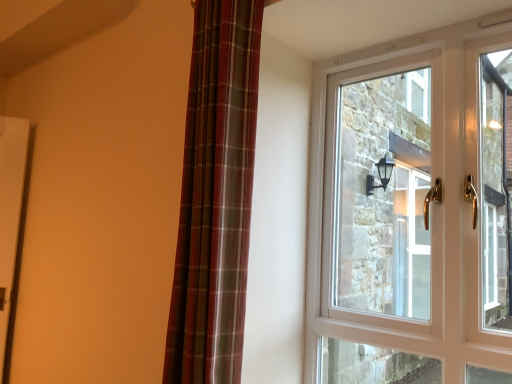
What do you see at coordinates (411, 211) in the screenshot? I see `white glossy door at upper right` at bounding box center [411, 211].

You are a GUI agent. You are given a task and a screenshot of the screen. Output one action in this format:
    pyautogui.click(x=<x>, y=<y>)
    Task: Click on the white glossy door at upper right
    The height and width of the screenshot is (384, 512).
    Given the screenshot: What is the action you would take?
    pyautogui.click(x=411, y=211)

Measure the distance between point (191, 272) and camera.

Point (191, 272) is 1.24 meters away from camera.

At what (x,y) coordinates should I click in order to perform the action: click on plaid fabric curtain at left. Please return your answer as a coordinate pair (x, y). Looking at the image, I should click on (215, 196).

What do you see at coordinates (215, 196) in the screenshot? I see `plaid fabric curtain at left` at bounding box center [215, 196].

The height and width of the screenshot is (384, 512). I want to click on white glossy door at upper right, so pos(411,211).

Does white glossy door at upper right appear on the right side of plaid fabric curtain at left?

Correct, you'll find white glossy door at upper right to the right of plaid fabric curtain at left.

Is white glossy door at upper right behind plaid fabric curtain at left?

That is True.

Considering the positions of point (449, 190) and point (214, 141), is point (449, 190) closer or farther from the camera than point (214, 141)?

Point (449, 190) appears to be farther away from the viewer than point (214, 141).

From the image's perspective, is white glossy door at upper right above or below plaid fabric curtain at left?

white glossy door at upper right is below plaid fabric curtain at left.

From a real-world perspective, does white glossy door at upper right sit lower than plaid fabric curtain at left?

Yes.

Which of these two, white glossy door at upper right or plaid fabric curtain at left, is thinner?

With smaller width is white glossy door at upper right.

Can you confirm if white glossy door at upper right is taller than plaid fabric curtain at left?

Yes, white glossy door at upper right is taller than plaid fabric curtain at left.

Does white glossy door at upper right have a larger size compared to plaid fabric curtain at left?

No.

Would you say white glossy door at upper right is inside or outside plaid fabric curtain at left?

white glossy door at upper right lies outside plaid fabric curtain at left.

Is white glossy door at upper right not close to plaid fabric curtain at left?

Absolutely, white glossy door at upper right is distant from plaid fabric curtain at left.

Is white glossy door at upper right aimed at plaid fabric curtain at left?

Yes, white glossy door at upper right faces towards plaid fabric curtain at left.

Locate an element on the screen. The height and width of the screenshot is (384, 512). window directly beneath the plaid fabric curtain at left (from a real-world perspective) is located at coordinates (411, 211).

Is plaid fabric curtain at left at the right side of white glossy door at upper right?

No.

In the scene shown: Is plaid fabric curtain at left further to the viewer compared to white glossy door at upper right?

No.

Considering the points (231, 151) and (341, 280), which point is in front, point (231, 151) or point (341, 280)?

The point (231, 151) is more forward.

From the image's perspective, which is below, plaid fabric curtain at left or white glossy door at upper right?

white glossy door at upper right is shown below in the image.

From a real-world perspective, which object rests below the other?

white glossy door at upper right is physically lower.

Which of these two, plaid fabric curtain at left or white glossy door at upper right, is wider?

plaid fabric curtain at left is wider.

Which of these two, plaid fabric curtain at left or white glossy door at upper right, stands taller?

With more height is white glossy door at upper right.

Which of these two, plaid fabric curtain at left or white glossy door at upper right, is smaller?

white glossy door at upper right.

Would you say white glossy door at upper right is part of plaid fabric curtain at left's contents?

No, white glossy door at upper right is located outside of plaid fabric curtain at left.

Is plaid fabric curtain at left not close to white glossy door at upper right?

Yes.

Could you tell me if plaid fabric curtain at left is turned towards white glossy door at upper right?

No, plaid fabric curtain at left does not turn towards white glossy door at upper right.

Can you tell me how much plaid fabric curtain at left and white glossy door at upper right differ in facing direction?

1.79 degrees separate the facing orientations of plaid fabric curtain at left and white glossy door at upper right.

Locate an element on the screen. The width and height of the screenshot is (512, 384). curtain located above the white glossy door at upper right (from a real-world perspective) is located at coordinates (215, 196).

Identify the location of curtain above the white glossy door at upper right (from a real-world perspective). The width and height of the screenshot is (512, 384). (215, 196).

In order to click on window behind the plaid fabric curtain at left in this screenshot , I will do `click(411, 211)`.